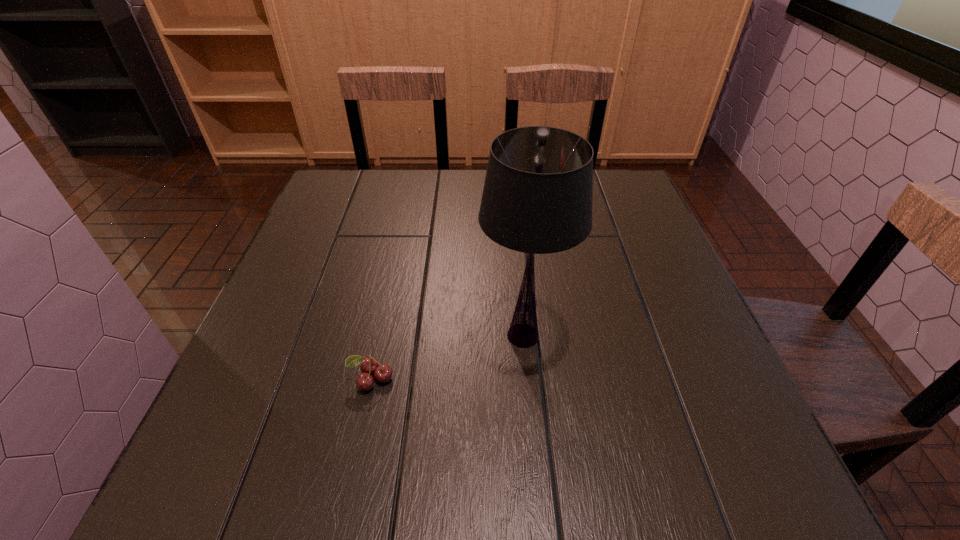
Locate an element on the screen. This screenshot has width=960, height=540. vacant space that satisfies the following two spatial constraints: 1. on the front-facing side of the lampshade; 2. on the leaves of the shorter object is located at coordinates (527, 379).

You are a GUI agent. You are given a task and a screenshot of the screen. Output one action in this format:
    pyautogui.click(x=<x>, y=<y>)
    Task: Click on the vacant space that satisfies the following two spatial constraints: 1. on the front-facing side of the taller object; 2. on the leaves of the left object
    
    Given the screenshot: What is the action you would take?
    pyautogui.click(x=527, y=379)